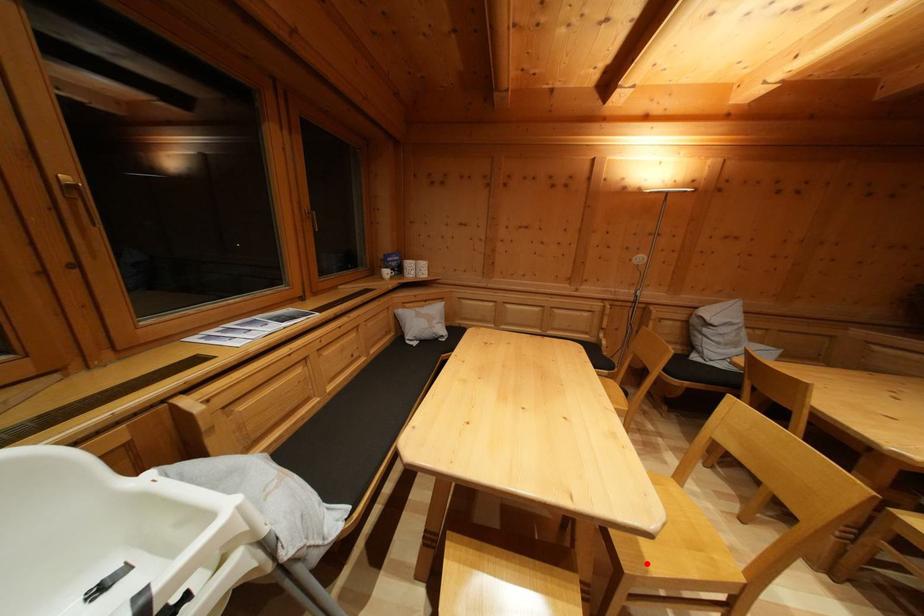
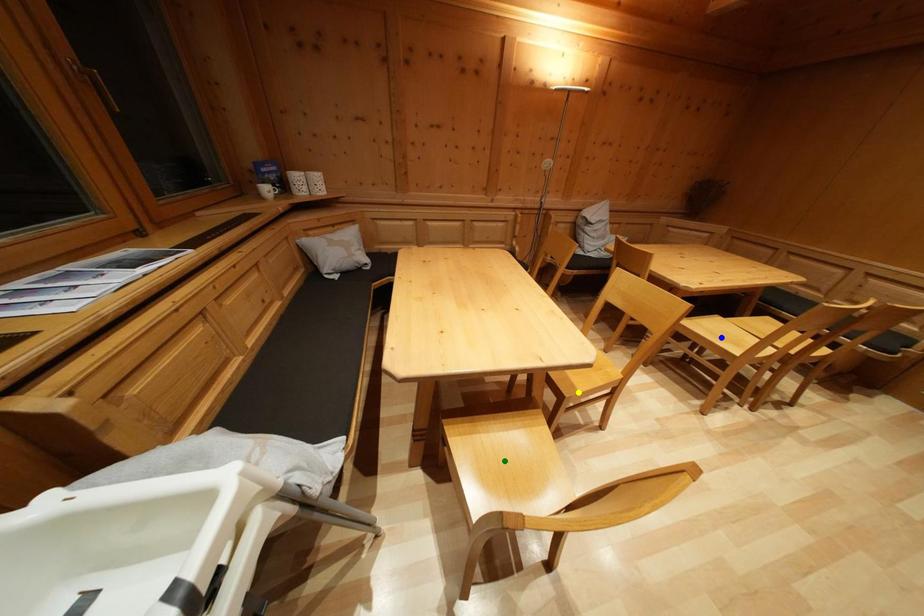
Question: I am providing you with two images of the same scene from different viewpoints. A red point is marked on the first image. You are given multiple points on the second image. Which point in image 2 is actually the same real-world point as the red point in image 1?

Choices:
 (A) green point
 (B) yellow point
 (C) blue point

Answer: (B)